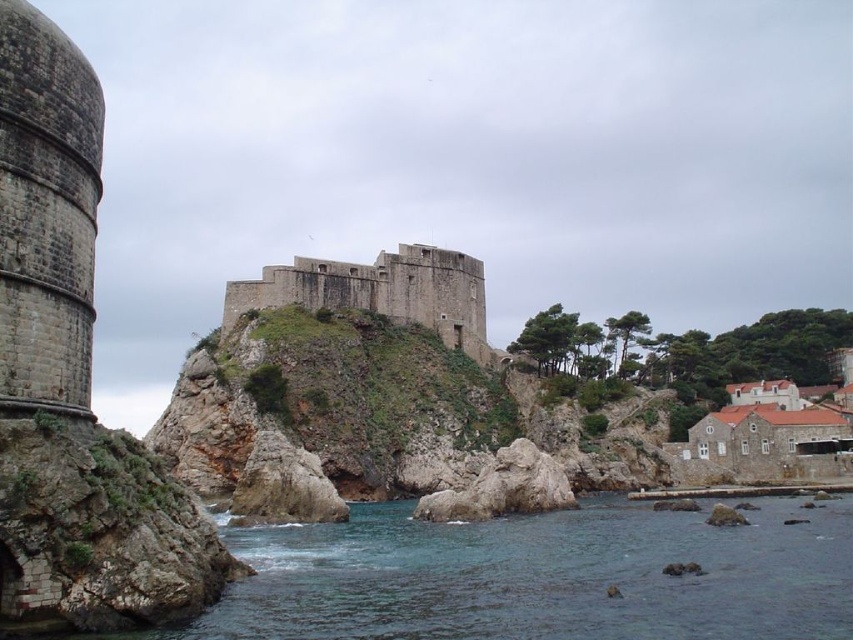
You are a drone operator trying to capture a photo of the brown stone castle at center from above. However, you need to ensure that the clear blue water at lower center doesn not block your view. Based on the scene, will the water obstruct the castle in the photo?

The clear blue water at lower center has a lesser height compared to the brown stone castle at center, so the water will not obstruct the castle in the photo since it is lower in elevation.

You are standing at the base of the fortress and want to reach the point marked as point (339, 609). Given that the path is rocky and uneven, and you can walk at a speed of 1.5 meters per second, how long will it take you to reach the point?

The distance between you and point (339, 609) is 48.14 meters. At a walking speed of 1.5 meters per second, it will take approximately 32.09 seconds to reach the point.